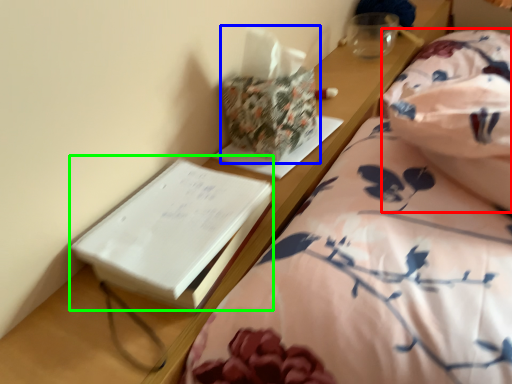
Question: Which is farther away from blanket (highlighted by a red box)? package (highlighted by a blue box) or paperback book (highlighted by a green box)?

Choices:
 (A) package
 (B) paperback book

Answer: (B)